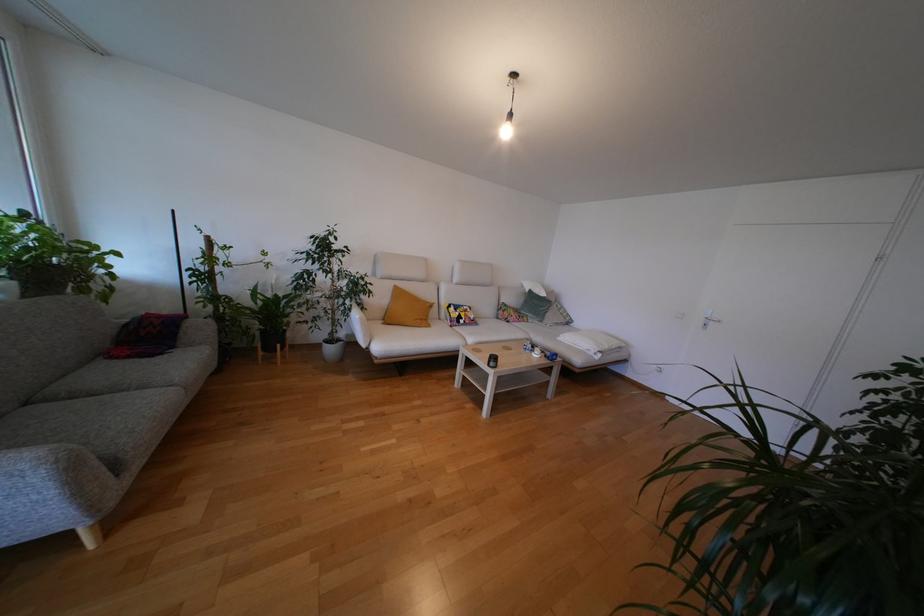
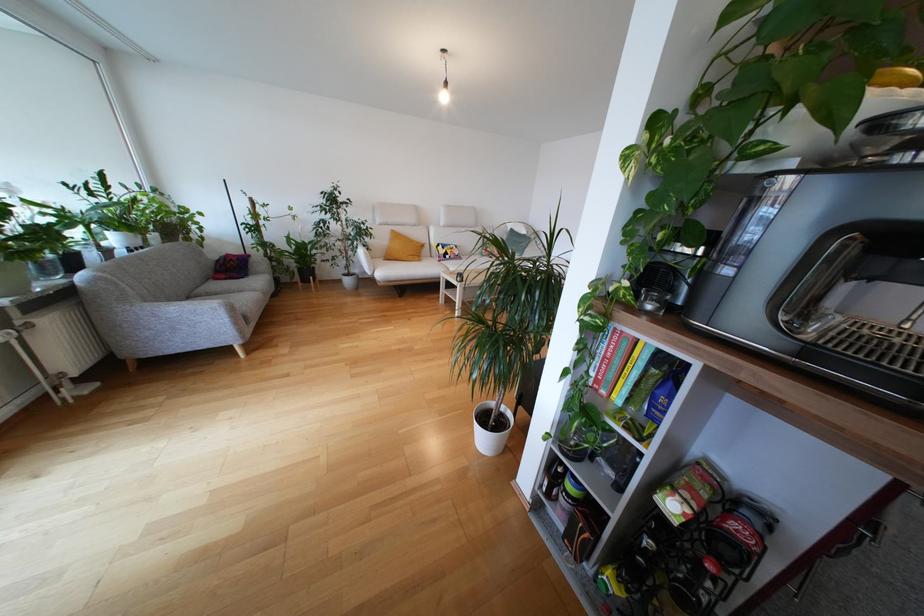
In the second image, find the point that corresponds to point (186, 334) in the first image.

(253, 268)